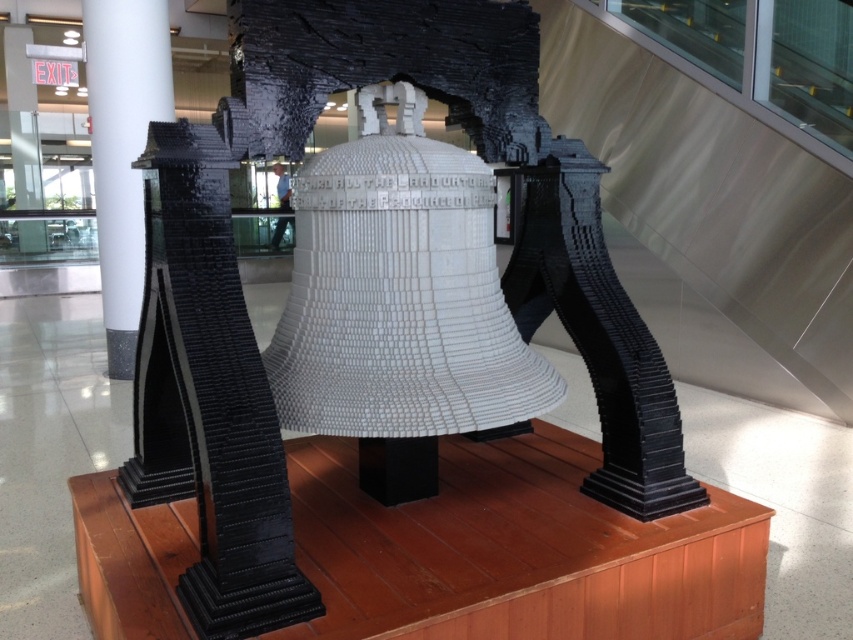
Question: Which point is closer to the camera?

Choices:
 (A) (201, 304)
 (B) (106, 42)

Answer: (A)

Question: Observing the image, what is the correct spatial positioning of white lego bell at center in reference to white glossy pillar at left?

Choices:
 (A) left
 (B) right

Answer: (B)

Question: Where is white lego bell at center located in relation to white glossy pillar at left in the image?

Choices:
 (A) right
 (B) left

Answer: (A)

Question: Which point is farther to the camera?

Choices:
 (A) (86, 26)
 (B) (173, 227)

Answer: (A)

Question: In this image, where is white lego bell at center located relative to white glossy pillar at left?

Choices:
 (A) above
 (B) below

Answer: (B)